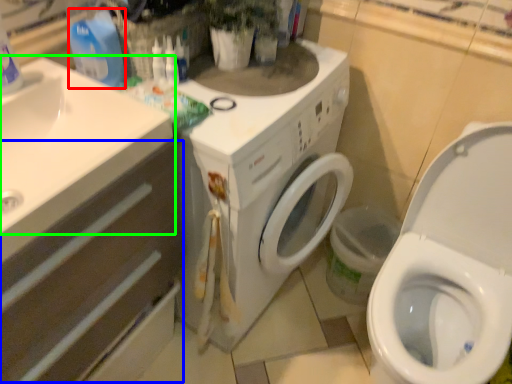
Question: Considering the real-world distances, which object is closest to cleaning product (highlighted by a red box)? drawer (highlighted by a blue box) or sink (highlighted by a green box).

Choices:
 (A) drawer
 (B) sink

Answer: (B)